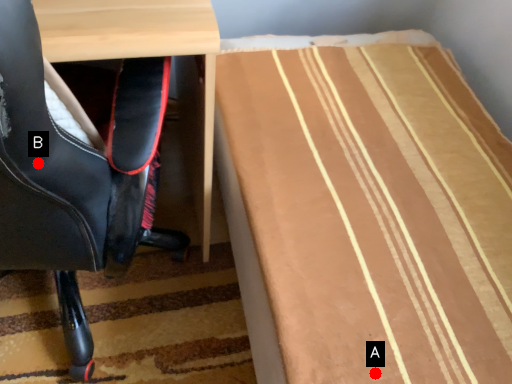
Question: Two points are circled on the image, labeled by A and B beside each circle. Which point appears closest to the camera in this image?

Choices:
 (A) A is closer
 (B) B is closer

Answer: (B)